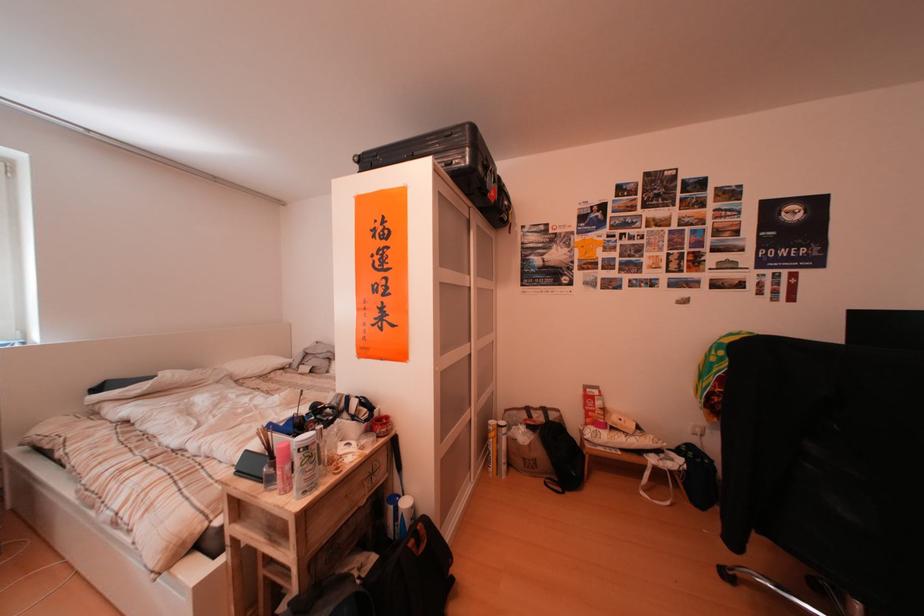
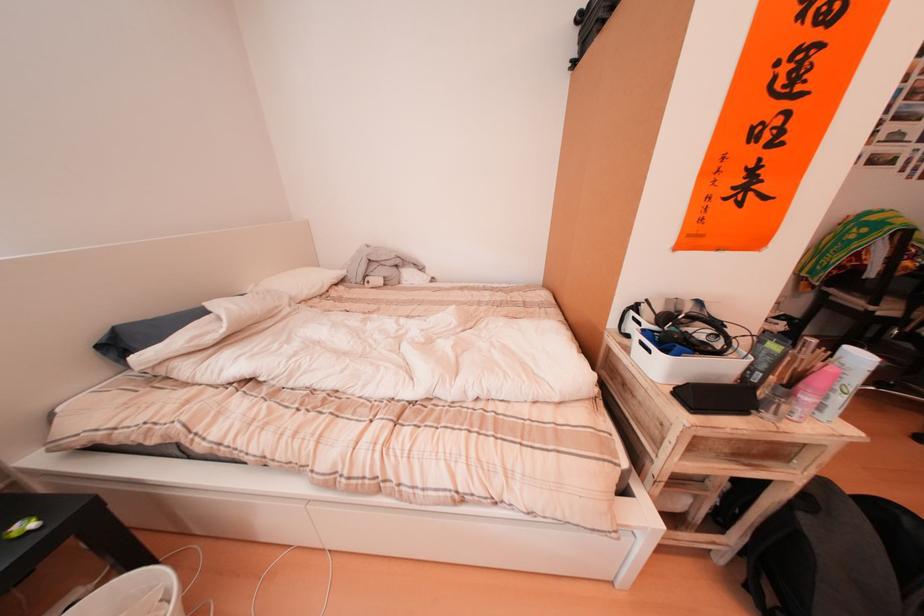
The images are taken continuously from a first-person perspective. In which direction are you moving?

The cameraman moved toward left, forward.